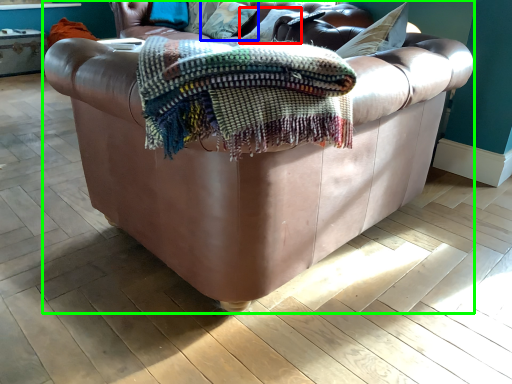
Question: Which is nearer to the pillow (highlighted by a red box)? pillow (highlighted by a blue box) or studio couch (highlighted by a green box).

Choices:
 (A) pillow
 (B) studio couch

Answer: (A)